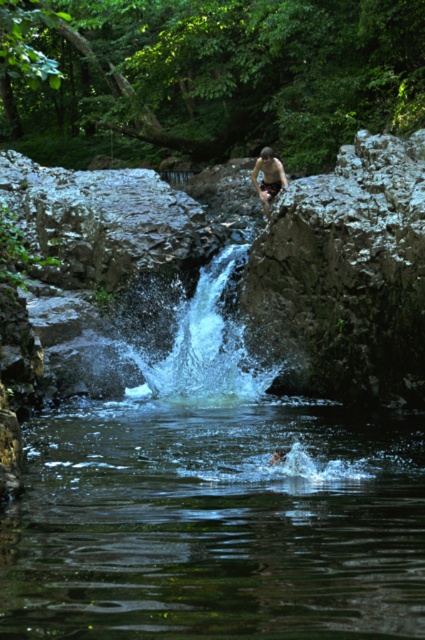
Is point (342, 515) more distant than point (268, 164)?

That is False.

Who is taller, clear water at center or smooth skin person at upper center?

smooth skin person at upper center is taller.

Between point (159, 636) and point (274, 188), which one is positioned in front?

Point (159, 636) is in front.

You are a GUI agent. You are given a task and a screenshot of the screen. Output one action in this format:
    pyautogui.click(x=<x>, y=<y>)
    Task: Click on the clear water at center
    
    Given the screenshot: What is the action you would take?
    pyautogui.click(x=217, y=524)